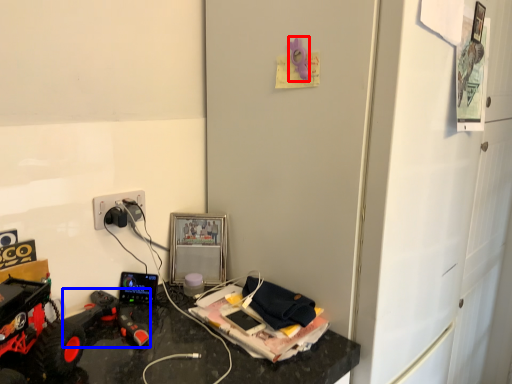
Question: Which of the following is the closest to the observer, toy (highlighted by a red box) or toy (highlighted by a blue box)?

Choices:
 (A) toy
 (B) toy

Answer: (B)